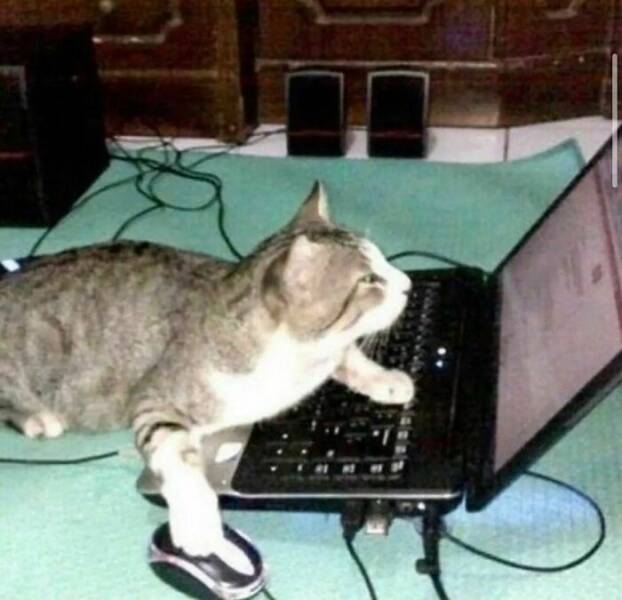
Locate an element on the screen. Image resolution: width=622 pixels, height=600 pixels. green blanket is located at coordinates (78, 540).